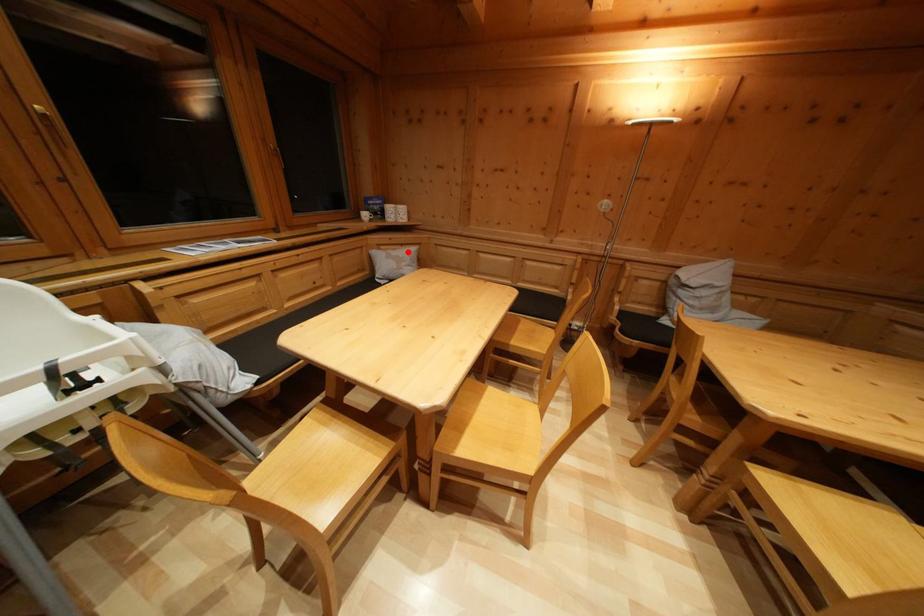
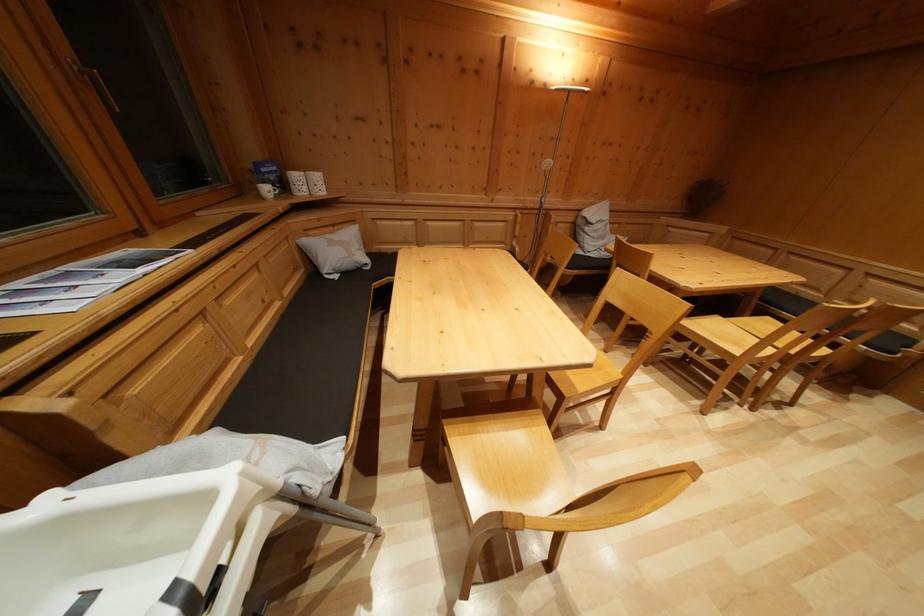
Question: I am providing you with two images of the same scene from different viewpoints. A red point is marked on the first image. Can you still see the location of the red point in image 2?

Choices:
 (A) Yes
 (B) No

Answer: (A)